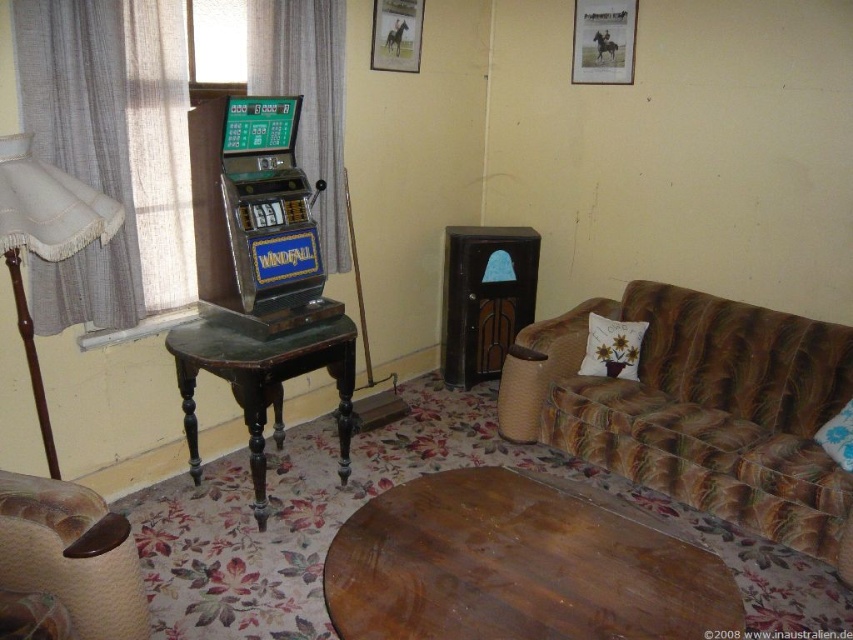
You are planning to place a new rug in the room. The rug you have is 1.2 meters wide. You want to place it under the leather armchair at lower left and the beige fabric lampshade at left. Will the rug be wide enough to cover both objects?

The leather armchair at lower left is wider than the beige fabric lampshade at left. Since the rug is 1.2 meters wide, it depends on the combined width of both objects. However, since the question only provides the comparison between their widths and not their exact measurements, we cannot definitively determine if the rug will be sufficient. More information about the individual widths is needed.

You are standing in the room and want to place a new decorative item between the metallic slot machine at left and the beige fabric lampshade at left. Since both objects are on the same side, can you determine which one is higher to decide where to place the item?

The metallic slot machine at left is above the beige fabric lampshade at left, so you should place the decorative item below the metallic slot machine at left and above the beige fabric lampshade at left to maintain the height difference.